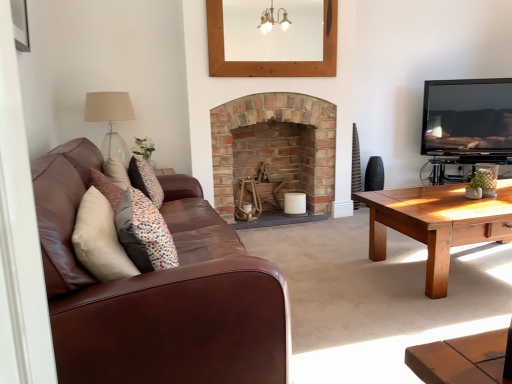
Question: Should I look upward or downward to see black glossy tv at upper right?

Choices:
 (A) up
 (B) down

Answer: (A)

Question: Is black glossy tv at upper right thinner than beige fabric lampshade at upper left?

Choices:
 (A) no
 (B) yes

Answer: (B)

Question: From the image's perspective, is black glossy tv at upper right below beige fabric lampshade at upper left?

Choices:
 (A) yes
 (B) no

Answer: (B)

Question: Can you confirm if black glossy tv at upper right is shorter than beige fabric lampshade at upper left?

Choices:
 (A) yes
 (B) no

Answer: (B)

Question: Is black glossy tv at upper right to the right of beige fabric lampshade at upper left from the viewer's perspective?

Choices:
 (A) no
 (B) yes

Answer: (B)

Question: Considering the relative sizes of black glossy tv at upper right and beige fabric lampshade at upper left in the image provided, is black glossy tv at upper right smaller than beige fabric lampshade at upper left?

Choices:
 (A) yes
 (B) no

Answer: (B)

Question: Considering the relative positions of black glossy tv at upper right and beige fabric lampshade at upper left in the image provided, is black glossy tv at upper right in front of beige fabric lampshade at upper left?

Choices:
 (A) no
 (B) yes

Answer: (A)

Question: From a real-world perspective, does wooden picture frame at upper center sit lower than brown leather couch at left?

Choices:
 (A) no
 (B) yes

Answer: (A)

Question: Does wooden picture frame at upper center have a smaller size compared to brown leather couch at left?

Choices:
 (A) no
 (B) yes

Answer: (B)

Question: Does wooden picture frame at upper center appear on the right side of brown leather couch at left?

Choices:
 (A) no
 (B) yes

Answer: (B)

Question: From the image's perspective, is wooden picture frame at upper center below brown leather couch at left?

Choices:
 (A) yes
 (B) no

Answer: (B)

Question: Considering the relative sizes of wooden picture frame at upper center and brown leather couch at left in the image provided, is wooden picture frame at upper center taller than brown leather couch at left?

Choices:
 (A) yes
 (B) no

Answer: (B)

Question: Does wooden picture frame at upper center appear on the left side of brown leather couch at left?

Choices:
 (A) yes
 (B) no

Answer: (B)

Question: From the image's perspective, is brown leather couch at left above beige fabric lampshade at upper left?

Choices:
 (A) yes
 (B) no

Answer: (B)